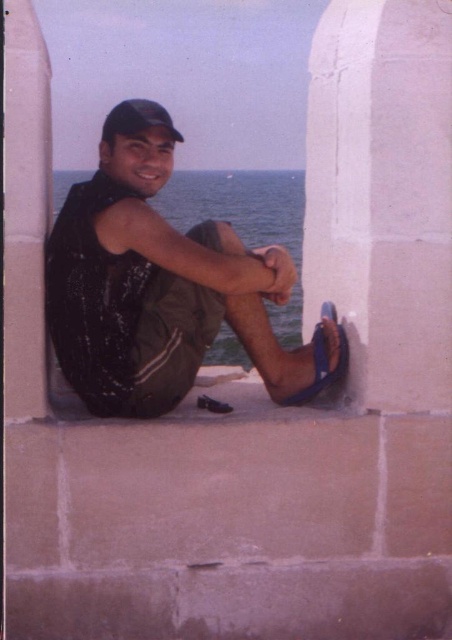
You are a photographer wanting to capture the black matte baseball cap at upper center and the white stone pillar at right in a single frame. Based on their heights, which object will appear taller in the photo?

The black matte baseball cap at upper center will appear taller in the photo because it has a greater height than the white stone pillar at right.

In the scene shown: You are a photographer trying to capture the best angle of the person sitting on the stone ledge by the sea. You notice two specific points in the scene labeled as point (324, 349) and point (123, 131). Which point is closer to your camera lens when positioned to focus on the person?

Point (324, 349) is further to the viewer than point (123, 131), so the point closer to your camera lens would be point (123, 131).